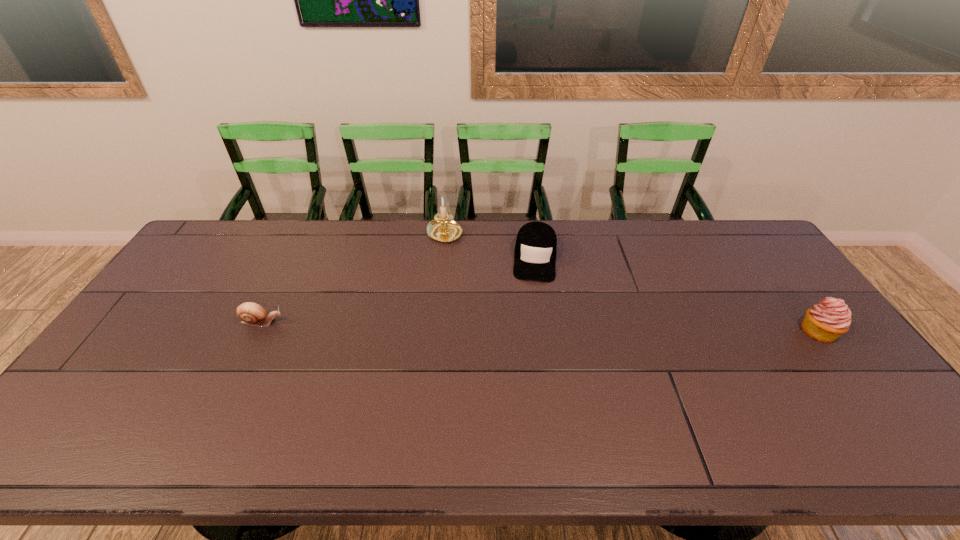
Locate an element on the screen. the leftmost object is located at coordinates (250, 313).

You are a GUI agent. You are given a task and a screenshot of the screen. Output one action in this format:
    pyautogui.click(x=<x>, y=<y>)
    Task: Click on the escargot
    
    Given the screenshot: What is the action you would take?
    pyautogui.click(x=250, y=313)

Locate an element on the screen. the second tallest object is located at coordinates (826, 321).

I want to click on cupcake, so click(x=826, y=321).

The image size is (960, 540). I want to click on cap, so click(535, 251).

Find the location of `the second shortest object`. the second shortest object is located at coordinates (535, 251).

I want to click on candle holder, so click(443, 228).

What are the coordinates of `the third object from right to left` in the screenshot? It's located at coord(443,228).

You are a GUI agent. You are given a task and a screenshot of the screen. Output one action in this format:
    pyautogui.click(x=<x>, y=<y>)
    Task: Click on the free space located on the front-facing side of the shortest object
    
    Given the screenshot: What is the action you would take?
    pyautogui.click(x=315, y=322)

The height and width of the screenshot is (540, 960). I want to click on vacant region located on the front of the third shortest object, so click(x=845, y=367).